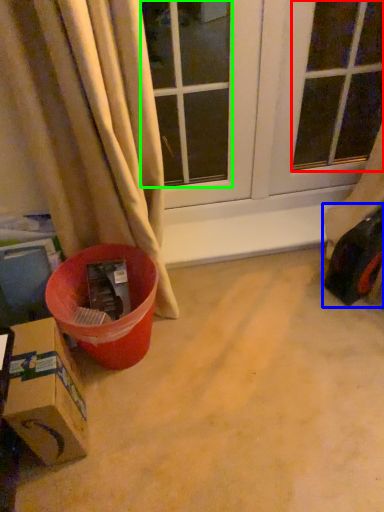
Question: Which object is the closest to the window screen (highlighted by a red box)? Choose among these: toy car (highlighted by a blue box) or window (highlighted by a green box).

Choices:
 (A) toy car
 (B) window

Answer: (B)